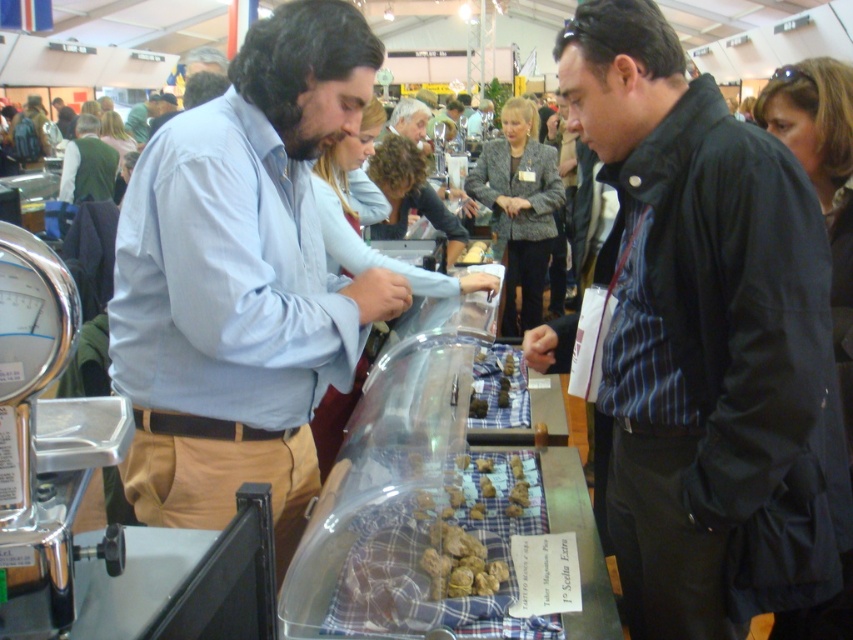
Can you confirm if black striped shirt at center is thinner than light blue shirt at center?

No, black striped shirt at center is not thinner than light blue shirt at center.

Is point (572, 65) closer to camera compared to point (286, 177)?

Yes, it is in front of point (286, 177).

Who is more distant from viewer, (648, 109) or (143, 276)?

Point (143, 276)

In order to click on black striped shirt at center in this screenshot , I will do `click(706, 342)`.